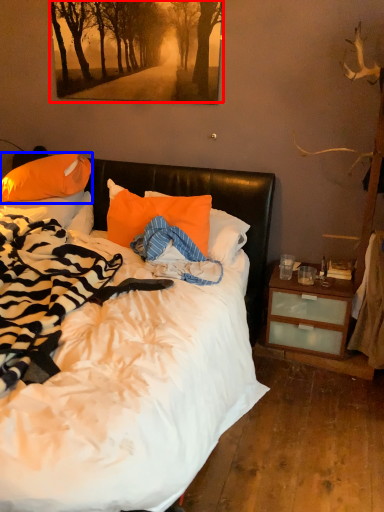
Question: Which object appears closest to the camera in this image, tree (highlighted by a red box) or pillow (highlighted by a blue box)?

Choices:
 (A) tree
 (B) pillow

Answer: (A)